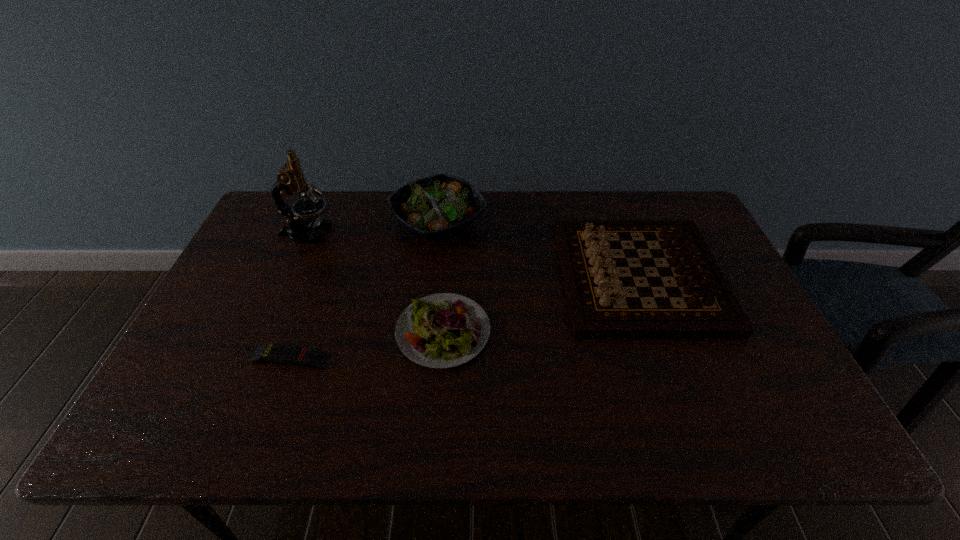
Image resolution: width=960 pixels, height=540 pixels. Identify the location of free location at the far edge of the desktop. (637, 198).

Image resolution: width=960 pixels, height=540 pixels. What are the coordinates of `vacant space at the near edge of the desktop` in the screenshot? It's located at (719, 432).

Find the location of `vacant region at the left edge of the desktop`. vacant region at the left edge of the desktop is located at coordinates (209, 362).

You are a GUI agent. You are given a task and a screenshot of the screen. Output one action in this format:
    pyautogui.click(x=<x>, y=<y>)
    Task: Click on the free region at the right edge of the desktop
    
    Given the screenshot: What is the action you would take?
    pyautogui.click(x=770, y=399)

Where is `free space at the far left corner`? The width and height of the screenshot is (960, 540). free space at the far left corner is located at coordinates (265, 215).

Image resolution: width=960 pixels, height=540 pixels. I want to click on vacant space at the near right corner of the desktop, so click(762, 413).

This screenshot has height=540, width=960. Find the location of `empty location between the nearer salad plate and the rightmost object`. empty location between the nearer salad plate and the rightmost object is located at coordinates (541, 304).

What are the coordinates of `free space that is in between the remote control and the tallest object` in the screenshot? It's located at (299, 296).

Identify the location of vacant space that's between the gameboard and the farther salad plate. This screenshot has height=540, width=960. (539, 249).

Locate an element on the screen. The height and width of the screenshot is (540, 960). vacant space in between the shortest object and the nearer salad plate is located at coordinates (367, 345).